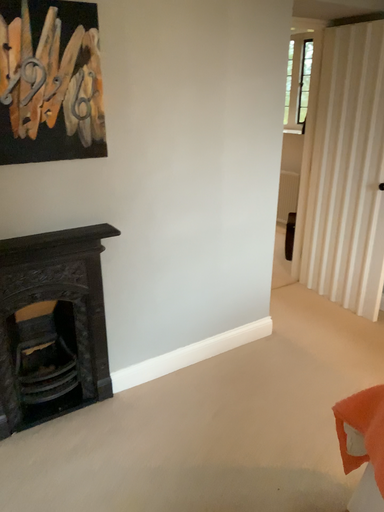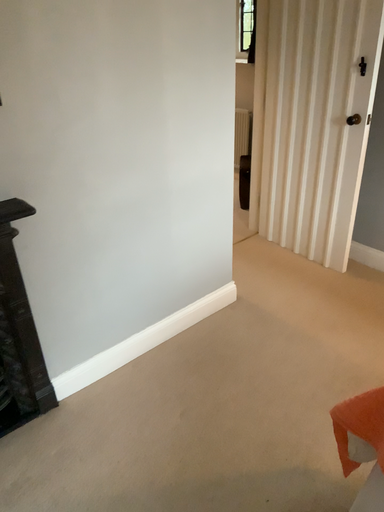
Question: How did the camera likely rotate when shooting the video?

Choices:
 (A) rotated left
 (B) rotated right

Answer: (B)